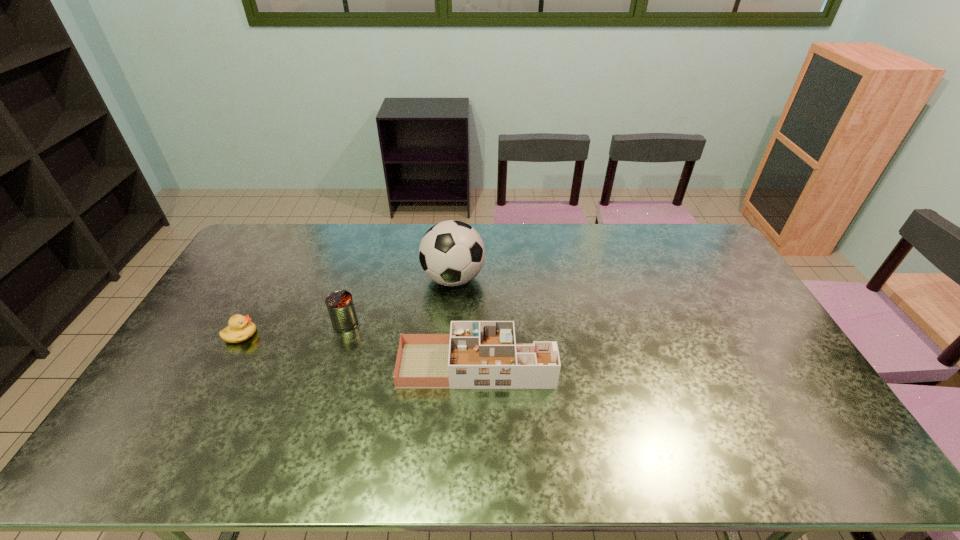
Locate an element on the screen. The height and width of the screenshot is (540, 960). vacant region between the second object from left to right and the shortest object is located at coordinates (293, 329).

The height and width of the screenshot is (540, 960). Find the location of `vacant area that lies between the second tallest object and the tallest object`. vacant area that lies between the second tallest object and the tallest object is located at coordinates (399, 301).

Find the location of a particular element. The height and width of the screenshot is (540, 960). free space between the second shortest object and the leftmost object is located at coordinates (358, 350).

Locate an element on the screen. vacant area that lies between the shortest object and the dollhouse is located at coordinates (358, 350).

Where is `blank region between the farthest object and the can`? The image size is (960, 540). blank region between the farthest object and the can is located at coordinates (399, 301).

Choose which object is the third nearest neighbor to the can. Please provide its 2D coordinates. Your answer should be formatted as a tuple, i.e. [(x, y)], where the tuple contains the x and y coordinates of a point satisfying the conditions above.

[(240, 329)]

Select which object is the second closest to the can. Please provide its 2D coordinates. Your answer should be formatted as a tuple, i.e. [(x, y)], where the tuple contains the x and y coordinates of a point satisfying the conditions above.

[(451, 253)]